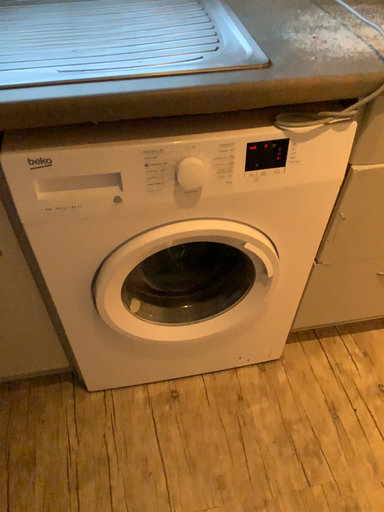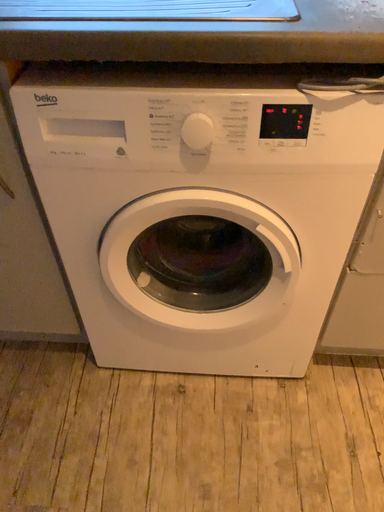
Question: Which way did the camera rotate in the video?

Choices:
 (A) rotated left
 (B) rotated right

Answer: (A)